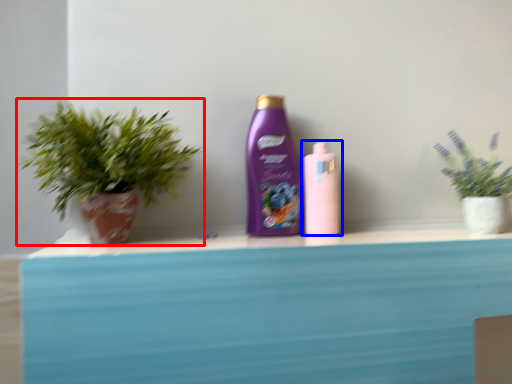
Question: Which object appears closest to the camera in this image, houseplant (highlighted by a red box) or bottle (highlighted by a blue box)?

Choices:
 (A) houseplant
 (B) bottle

Answer: (A)